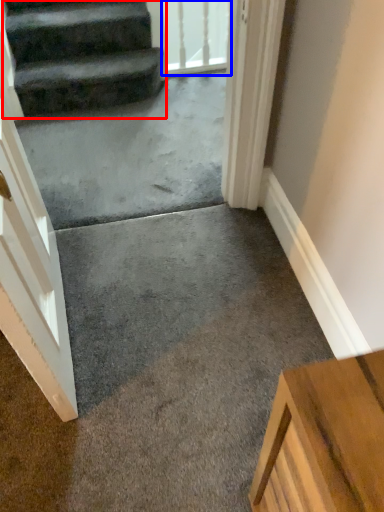
Question: Which point is closer to the camera, stairs (highlighted by a red box) or glass door (highlighted by a blue box)?

Choices:
 (A) stairs
 (B) glass door

Answer: (A)